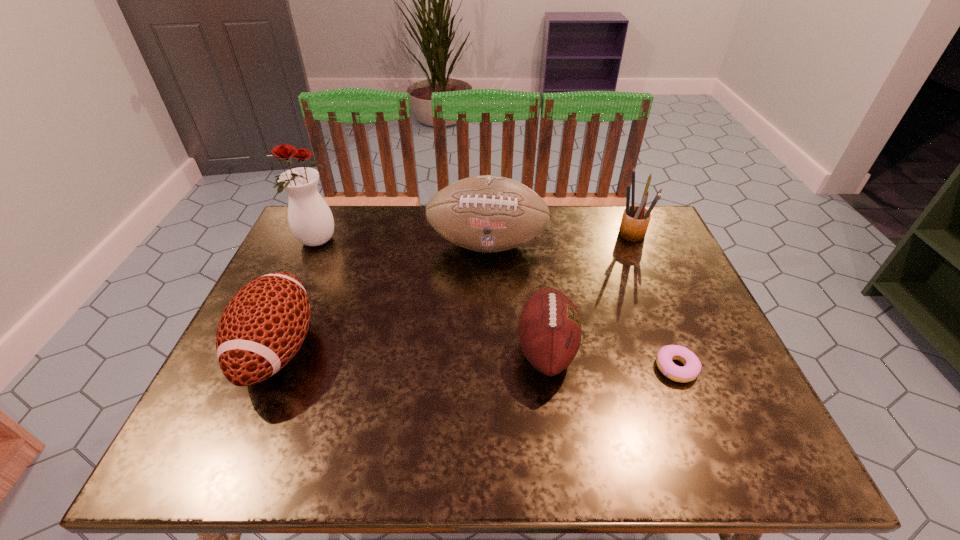
Locate an element on the screen. The image size is (960, 540). empty location between the tallest football (American) and the second shortest object is located at coordinates (516, 296).

You are a GUI agent. You are given a task and a screenshot of the screen. Output one action in this format:
    pyautogui.click(x=<x>, y=<y>)
    Task: Click on the vacant area between the vase and the doughnut
    
    Given the screenshot: What is the action you would take?
    pyautogui.click(x=496, y=305)

The width and height of the screenshot is (960, 540). What are the coordinates of `unoccupied position between the tallest football (American) and the leftmost football (American)` in the screenshot? It's located at (382, 297).

The width and height of the screenshot is (960, 540). What are the coordinates of `free space between the second shortest football (American) and the doughnut` in the screenshot? It's located at (477, 359).

Find the location of a particular element. vacant area that lies between the pencil box and the leftmost football (American) is located at coordinates (454, 291).

Locate which object is the fifth closest to the shortest object. Please provide its 2D coordinates. Your answer should be formatted as a tuple, i.e. [(x, y)], where the tuple contains the x and y coordinates of a point satisfying the conditions above.

[(310, 219)]

Choose which object is the fifth nearest neighbor to the fifth tallest object. Please provide its 2D coordinates. Your answer should be formatted as a tuple, i.e. [(x, y)], where the tuple contains the x and y coordinates of a point satisfying the conditions above.

[(310, 219)]

Locate an element on the screen. football (American) that is the closest to the pencil box is located at coordinates (488, 213).

You are a GUI agent. You are given a task and a screenshot of the screen. Output one action in this format:
    pyautogui.click(x=<x>, y=<y>)
    Task: Click on the football (American) that is the third closest to the shortest object
    
    Given the screenshot: What is the action you would take?
    pyautogui.click(x=263, y=326)

Where is `free location that satisfies the following two spatial constraints: 1. on the laces of the farthest football (American); 2. on the left side of the shortest object`? This screenshot has height=540, width=960. free location that satisfies the following two spatial constraints: 1. on the laces of the farthest football (American); 2. on the left side of the shortest object is located at coordinates (490, 368).